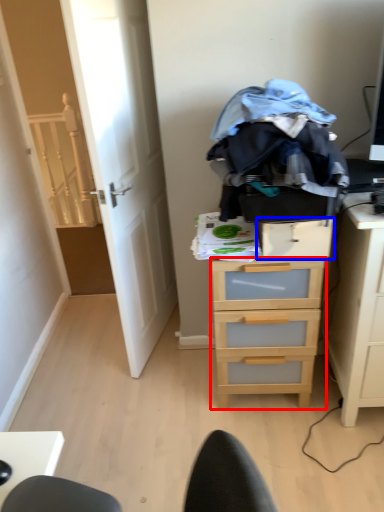
Question: Which object appears farthest to the camera in this image, chest of drawers (highlighted by a red box) or drawer (highlighted by a blue box)?

Choices:
 (A) chest of drawers
 (B) drawer

Answer: (A)